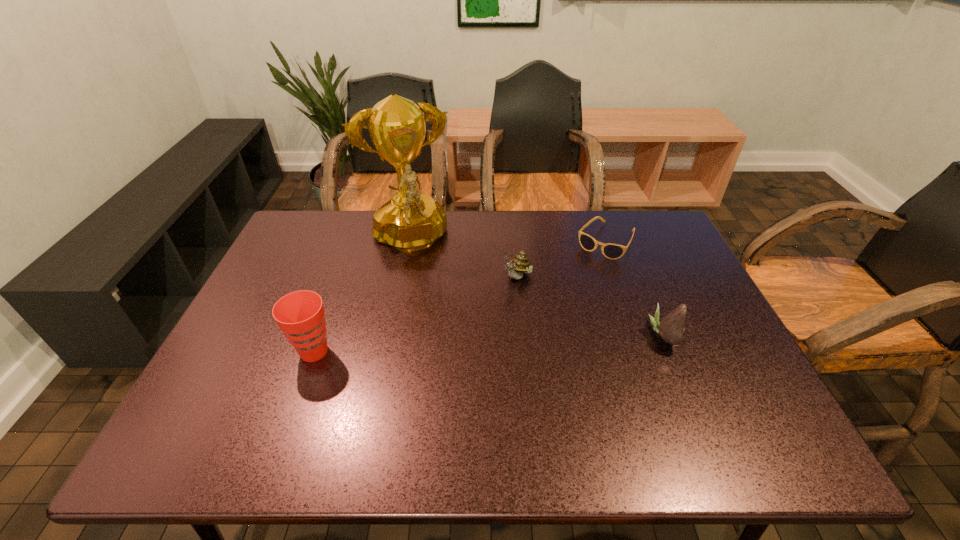
At what (x,y) coordinates should I click in order to perform the action: click on the second tallest object. Please return your answer as a coordinate pair (x, y). This screenshot has height=540, width=960. Looking at the image, I should click on (300, 315).

Where is `avocado`? avocado is located at coordinates (671, 328).

Where is `award`? Image resolution: width=960 pixels, height=540 pixels. award is located at coordinates coord(410,221).

Identify the location of the shortest object. The image size is (960, 540). (611, 251).

Image resolution: width=960 pixels, height=540 pixels. Find the location of `snail`. snail is located at coordinates (520, 264).

Where is `free spot located on the right of the second tallest object`? This screenshot has width=960, height=540. free spot located on the right of the second tallest object is located at coordinates (386, 352).

Locate an element on the screen. The width and height of the screenshot is (960, 540). vacant space located on the seed side of the avocado is located at coordinates (697, 335).

I want to click on vacant point located 0.120m on the front side of the award, so click(x=427, y=298).

This screenshot has height=540, width=960. What are the coordinates of `vacant space positioned 0.160m on the front side of the award` in the screenshot? It's located at point(430,308).

I want to click on free space located 0.310m on the front side of the award, so click(x=444, y=349).